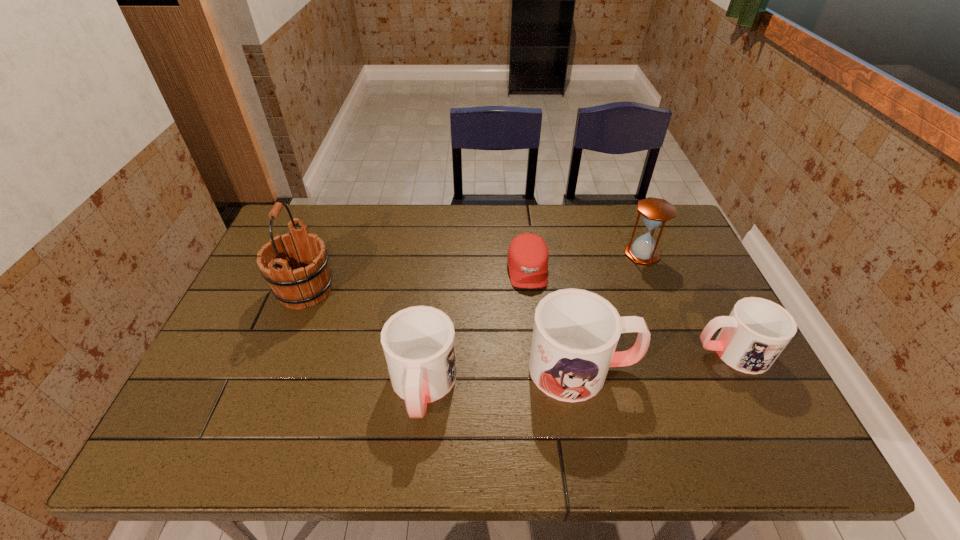
Where is `vacant place for an extra mug on the left`? This screenshot has width=960, height=540. vacant place for an extra mug on the left is located at coordinates (252, 405).